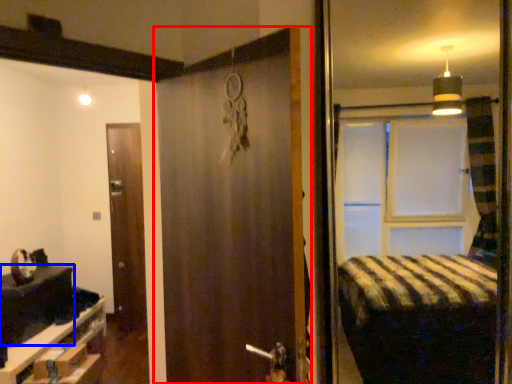
Question: Which point is closer to the camera, door (highlighted by a red box) or table (highlighted by a blue box)?

Choices:
 (A) door
 (B) table

Answer: (A)